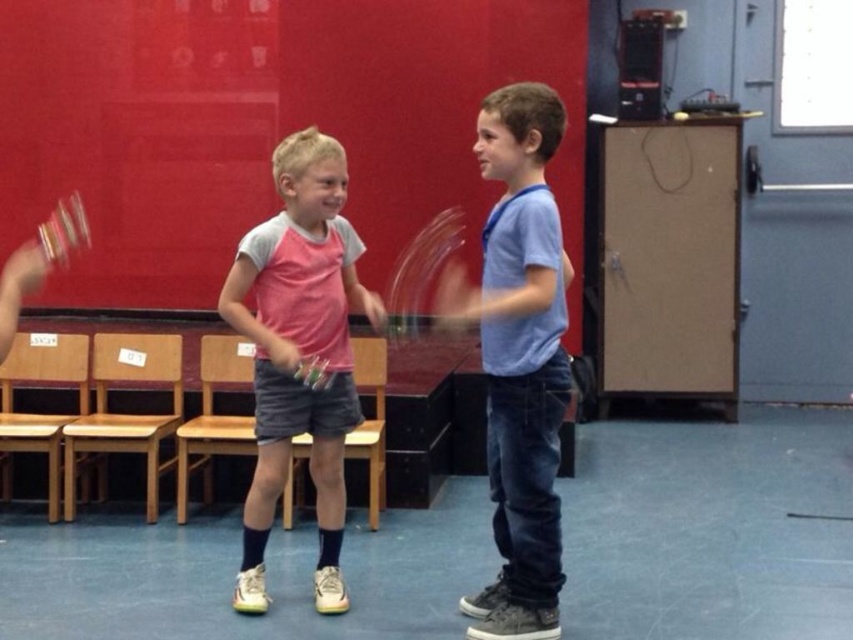
You are standing in front of the classroom scene. There are two points marked in the image. The first point is at coordinate point [527,170] and the second is at point [78,195]. Which point is closer to your viewpoint?

Point [527,170] is closer to the camera than point [78,195], so the first point is closer to your viewpoint.

You are a teacher observing the scene. You notice two children wearing blue denim jeans at center and pink fabric shirt at center. From your perspective, which clothing item is positioned more to the right?

The blue denim jeans at center are to the right of the pink fabric shirt at center, so the blue denim jeans at center is positioned more to the right.

You are standing at point (289, 218) and want to walk to the exit door located at point (476, 144). Is the exit door in front of you or behind you?

The exit door at point (476, 144) is in front of you because it is positioned in front of your current location at point (289, 218).